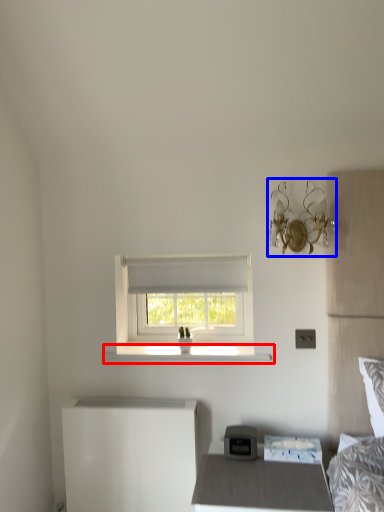
Question: Which object appears farthest to the camera in this image, window sill (highlighted by a red box) or light fixture (highlighted by a blue box)?

Choices:
 (A) window sill
 (B) light fixture

Answer: (A)